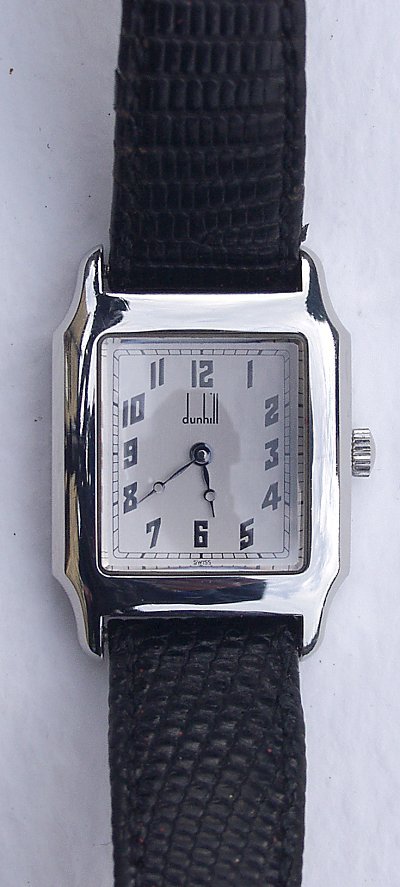
Identify the location of silver small turnable knob. (358, 451).